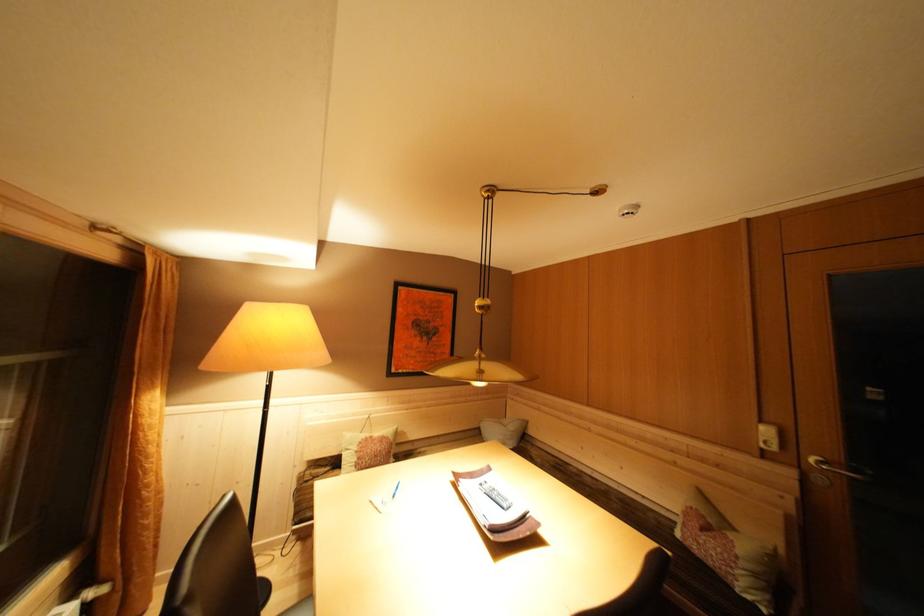
Where would you pull the metal door handle? Please return your answer as a coordinate pair (x, y).

(833, 468)